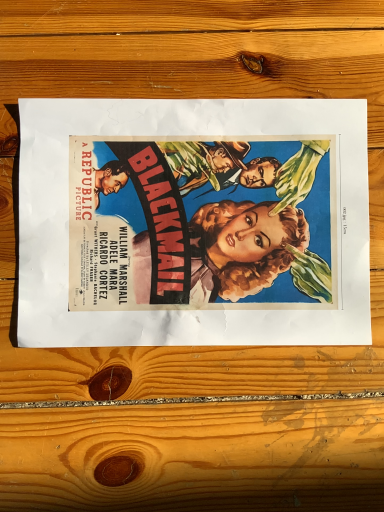
In order to click on empty space that is ontop of matte paper poster at center (from a real-world perspective) in this screenshot , I will do `click(196, 218)`.